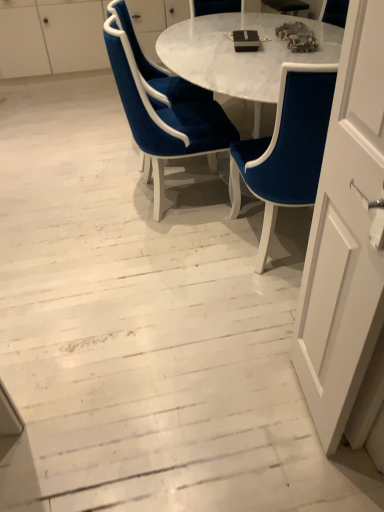
Question: Is velvet blue chair at center, the 3th chair from the left, thinner than velvet blue chair at center, arranged as the 3th chair when viewed from the right?

Choices:
 (A) no
 (B) yes

Answer: (B)

Question: Is velvet blue chair at center, the 3th chair from the left, located outside velvet blue chair at center, arranged as the 3th chair when viewed from the right?

Choices:
 (A) no
 (B) yes

Answer: (B)

Question: From a real-world perspective, is velvet blue chair at center, which is the 1th chair from right to left, positioned under velvet blue chair at center, the first chair positioned from the left, based on gravity?

Choices:
 (A) no
 (B) yes

Answer: (A)

Question: Is velvet blue chair at center, the 3th chair from the left, far away from velvet blue chair at center, arranged as the 3th chair when viewed from the right?

Choices:
 (A) no
 (B) yes

Answer: (A)

Question: From the image's perspective, would you say velvet blue chair at center, which is the 1th chair from right to left, is shown under velvet blue chair at center, arranged as the 3th chair when viewed from the right?

Choices:
 (A) yes
 (B) no

Answer: (A)

Question: Considering the relative sizes of velvet blue chair at center, the 3th chair from the left, and velvet blue chair at center, arranged as the 3th chair when viewed from the right, in the image provided, is velvet blue chair at center, the 3th chair from the left, shorter than velvet blue chair at center, arranged as the 3th chair when viewed from the right,?

Choices:
 (A) yes
 (B) no

Answer: (B)

Question: Can you confirm if velvet blue chair at center, which appears as the 2th chair when viewed from the left, is positioned to the right of velvet blue chair at center, arranged as the 3th chair when viewed from the right?

Choices:
 (A) yes
 (B) no

Answer: (A)

Question: Does velvet blue chair at center, which appears as the 2th chair when viewed from the left, lie behind velvet blue chair at center, arranged as the 3th chair when viewed from the right?

Choices:
 (A) no
 (B) yes

Answer: (A)

Question: From the image's perspective, is velvet blue chair at center, which appears as the 2th chair when viewed from the left, below velvet blue chair at center, the first chair positioned from the left?

Choices:
 (A) no
 (B) yes

Answer: (B)

Question: Is velvet blue chair at center, acting as the 2th chair starting from the right, facing away from velvet blue chair at center, arranged as the 3th chair when viewed from the right?

Choices:
 (A) no
 (B) yes

Answer: (A)

Question: Can you confirm if velvet blue chair at center, which appears as the 2th chair when viewed from the left, is thinner than velvet blue chair at center, arranged as the 3th chair when viewed from the right?

Choices:
 (A) no
 (B) yes

Answer: (A)

Question: Is velvet blue chair at center, acting as the 2th chair starting from the right, bigger than velvet blue chair at center, arranged as the 3th chair when viewed from the right?

Choices:
 (A) yes
 (B) no

Answer: (A)

Question: Is white glossy dresser at upper center beside velvet blue chair at center, which appears as the 2th chair when viewed from the left?

Choices:
 (A) yes
 (B) no

Answer: (B)